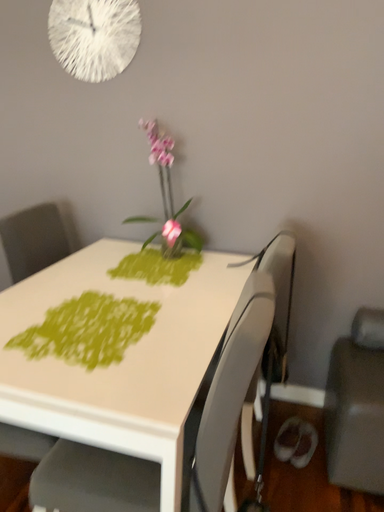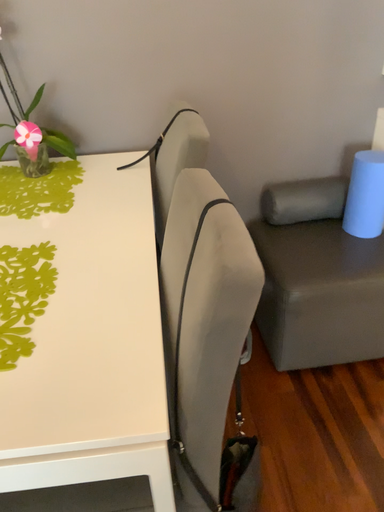
Question: Which way did the camera rotate in the video?

Choices:
 (A) rotated right
 (B) rotated left

Answer: (A)